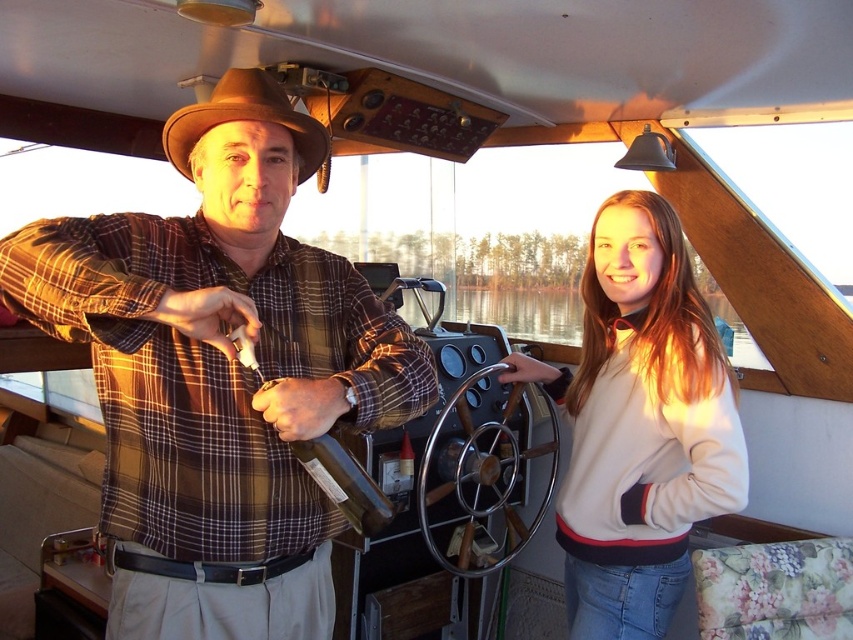
Question: Is brown plaid shirt at center bigger than brown felt cowboy hat at upper center?

Choices:
 (A) yes
 (B) no

Answer: (A)

Question: Based on their relative distances, which object is farther from the brown felt cowboy hat at upper center?

Choices:
 (A) light beige fleece at center
 (B) brown plaid shirt at center

Answer: (A)

Question: Which object is the closest to the light beige fleece at center?

Choices:
 (A) brown felt cowboy hat at upper center
 (B) brown plaid shirt at center

Answer: (B)

Question: Which point is farther to the camera?

Choices:
 (A) brown felt cowboy hat at upper center
 (B) brown plaid shirt at center
 (C) light beige fleece at center

Answer: (C)

Question: Is brown plaid shirt at center bigger than brown felt cowboy hat at upper center?

Choices:
 (A) no
 (B) yes

Answer: (B)

Question: Can you confirm if light beige fleece at center is positioned to the right of brown felt cowboy hat at upper center?

Choices:
 (A) yes
 (B) no

Answer: (A)